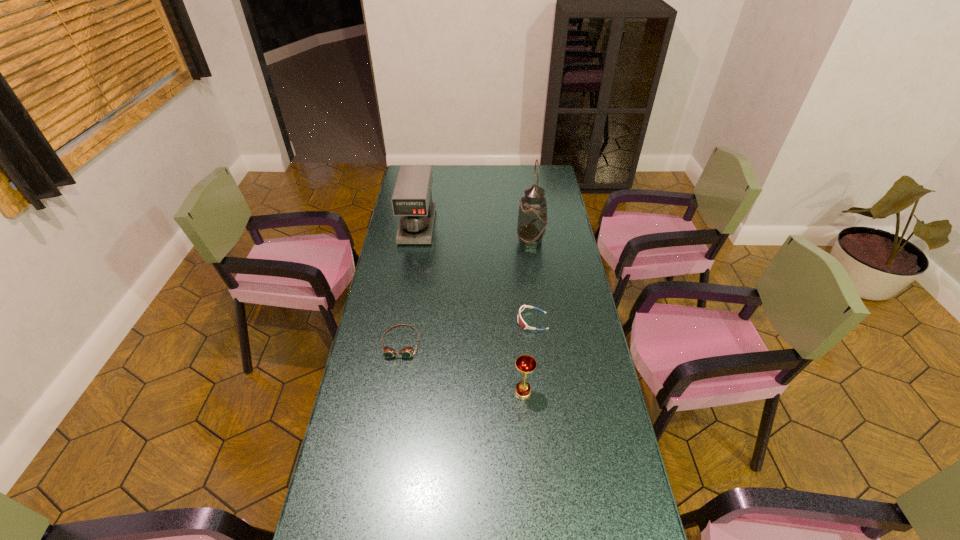
Find the location of `free region that satisfies the following two spatial constraints: 1. on the carafe side of the tallest object; 2. on the left side of the second tallest object`. free region that satisfies the following two spatial constraints: 1. on the carafe side of the tallest object; 2. on the left side of the second tallest object is located at coordinates (415, 241).

Identify the location of vacant space that satisfies the following two spatial constraints: 1. on the carafe side of the nearest object; 2. on the left side of the coffee maker. This screenshot has height=540, width=960. (389, 392).

The height and width of the screenshot is (540, 960). I want to click on free space that satisfies the following two spatial constraints: 1. on the carafe side of the chalice; 2. on the left side of the second tallest object, so click(x=389, y=392).

Where is `vacant point that satisfies the following two spatial constraints: 1. on the carafe side of the chalice; 2. on the right side of the coffee maker`? The image size is (960, 540). vacant point that satisfies the following two spatial constraints: 1. on the carafe side of the chalice; 2. on the right side of the coffee maker is located at coordinates (389, 392).

The height and width of the screenshot is (540, 960). Find the location of `vacant point that satisfies the following two spatial constraints: 1. through the lenses of the left goggles; 2. on the right side of the nearest object`. vacant point that satisfies the following two spatial constraints: 1. through the lenses of the left goggles; 2. on the right side of the nearest object is located at coordinates (393, 392).

Find the location of `vacant space that satisfies the following two spatial constraints: 1. on the carafe side of the fourth shortest object; 2. on the left side of the oil lamp`. vacant space that satisfies the following two spatial constraints: 1. on the carafe side of the fourth shortest object; 2. on the left side of the oil lamp is located at coordinates (415, 241).

The height and width of the screenshot is (540, 960). Identify the location of free space that satisfies the following two spatial constraints: 1. through the lenses of the third shortest object; 2. on the right side of the left goggles. (393, 392).